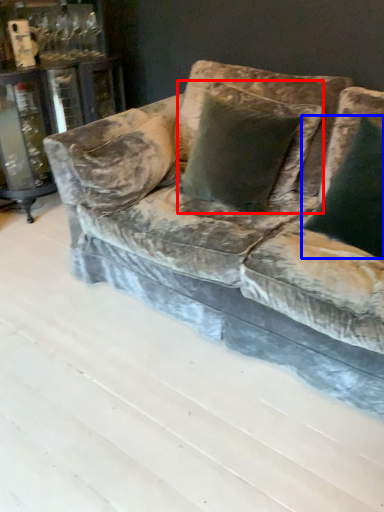
Question: Among these objects, which one is farthest to the camera, pillow (highlighted by a red box) or pillow (highlighted by a blue box)?

Choices:
 (A) pillow
 (B) pillow

Answer: (A)